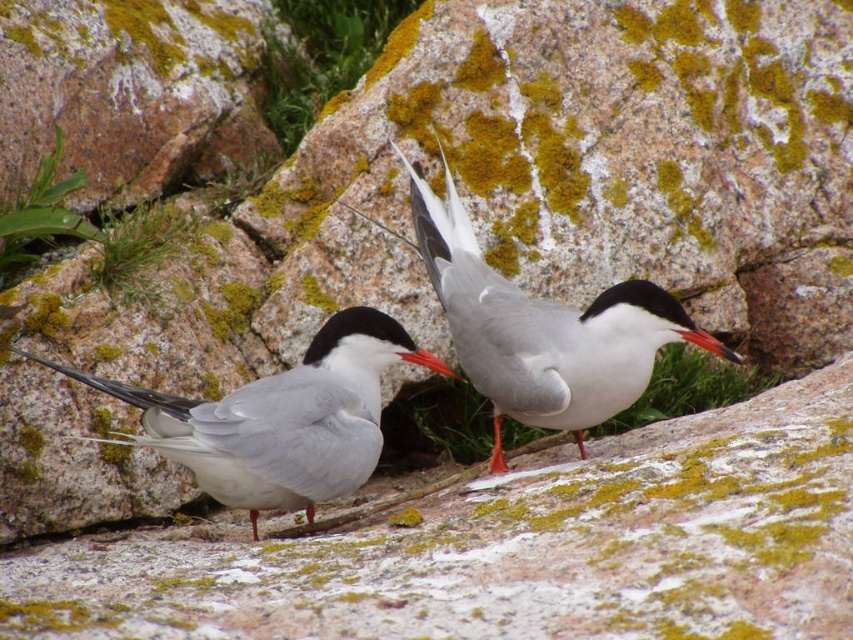
You are a nature photographer aiming to capture the white glossy bird at center. Your camera has a focus point at coordinates 0.5, 0.6. Will the focus point align with the bird?

The white glossy bird at center is at point (x=537, y=330), which is slightly to the right and above the camera focus point at (x=511, y=320). Therefore, the focus point will not align perfectly with the bird.

You are a wildlife photographer aiming to capture the terns in the image. You notice the white glossy tern at center and the orange glossy beak at center. Which object would you focus on first if you want to ensure both are in sharp focus?

The white glossy tern at center is larger than the orange glossy beak at center, so focusing on the white glossy tern at center first would help ensure both are in sharp focus since it occupies more of the frame.

Looking at this image, you are a wildlife photographer aiming to capture a closeup shot of the white glossy bird at center and the smooth glossy beak at center. Based on their sizes, which one should you zoom in on more to ensure both are in focus?

The white glossy bird at center is wider than the smooth glossy beak at center, so you should zoom in more on the white glossy bird at center to ensure both are in focus.